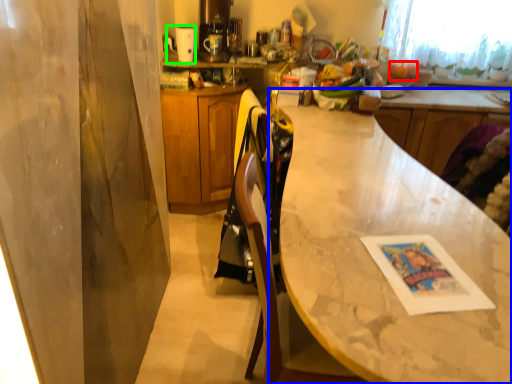
Question: Which object is positioned closest to fruit (highlighted by a red box)? Select from countertop (highlighted by a blue box) and appliance (highlighted by a green box).

Choices:
 (A) countertop
 (B) appliance

Answer: (B)